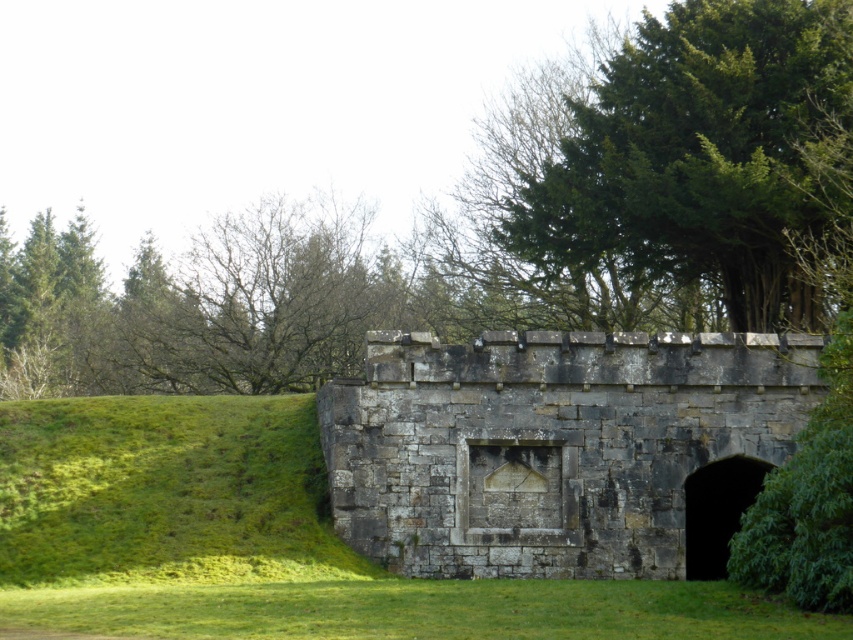
Question: Which object is positioned closest to the gray stone bunker at center?

Choices:
 (A) green leafy tree at upper right
 (B) green leafy tree at upper center

Answer: (A)

Question: Which point is farther to the camera?

Choices:
 (A) green leafy tree at upper right
 (B) green leafy tree at upper center
 (C) gray stone bunker at center

Answer: (A)

Question: Is gray stone bunker at center above green leafy tree at upper right?

Choices:
 (A) no
 (B) yes

Answer: (A)

Question: Considering the relative positions of green leafy tree at upper center and gray stone bunker at center in the image provided, where is green leafy tree at upper center located with respect to gray stone bunker at center?

Choices:
 (A) above
 (B) below

Answer: (A)

Question: Is green leafy tree at upper center to the left of green leafy tree at upper right from the viewer's perspective?

Choices:
 (A) no
 (B) yes

Answer: (B)

Question: Among these objects, which one is nearest to the camera?

Choices:
 (A) green leafy tree at upper center
 (B) green leafy tree at upper right
 (C) gray stone bunker at center

Answer: (C)